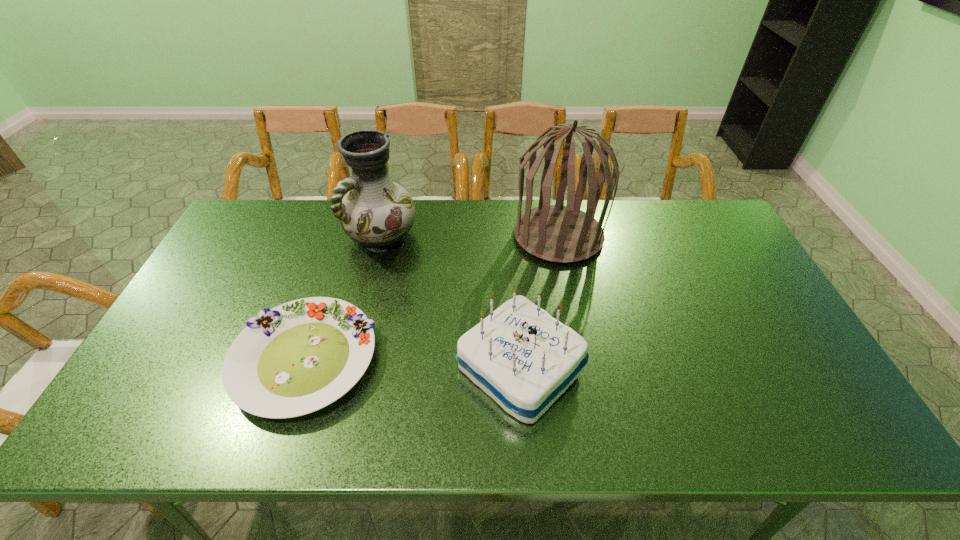
Find the location of a particular element. This screenshot has width=960, height=540. birdcage is located at coordinates click(557, 233).

At what (x,y) coordinates should I click in order to perform the action: click on the second tallest object. Please return your answer as a coordinate pair (x, y). This screenshot has width=960, height=540. Looking at the image, I should click on (376, 212).

Find the location of a particular element. Image resolution: width=960 pixels, height=540 pixels. birthday cake is located at coordinates (522, 357).

This screenshot has height=540, width=960. I want to click on the shortest object, so click(x=299, y=357).

Where is `vacant space located 0.160m on the left of the birdcage`? The height and width of the screenshot is (540, 960). vacant space located 0.160m on the left of the birdcage is located at coordinates (465, 235).

Find the location of a particular element. This screenshot has width=960, height=540. vacant space situated 0.230m on the right of the second tallest object is located at coordinates (487, 236).

At what (x,y) coordinates should I click in order to perform the action: click on free space located on the back of the third tallest object. Please return your answer as a coordinate pair (x, y). This screenshot has width=960, height=540. Looking at the image, I should click on (512, 265).

I want to click on free location located 0.130m on the left of the salad plate, so click(182, 360).

Image resolution: width=960 pixels, height=540 pixels. Identify the location of birdcage at the far edge. (557, 233).

What are the coordinates of `vase located at the far edge` in the screenshot? It's located at (376, 212).